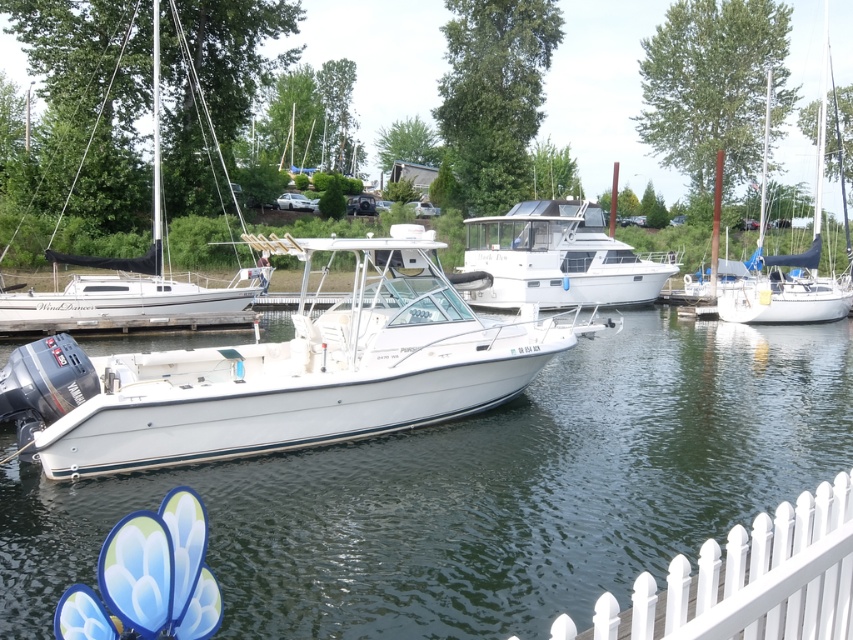
You are a photographer planning to capture the entire scene of the marina. You want to ensure both the white glossy water at center and the white picket fence at lower right are clearly visible in your shot. Given their sizes, which object might require you to adjust your camera angle to include it properly?

The white glossy water at center has a larger size compared to the white picket fence at lower right, so it might require adjusting the camera angle to ensure it fits within the frame.

You are a photographer trying to capture the reflection of the white glossy boat at center in the white glossy water at center. Based on the scene, can you confirm if the reflection will be fully visible in the water?

The white glossy water at center is bigger than the white glossy boat at center, so the reflection of the white glossy boat at center should be fully visible in the white glossy water at center.